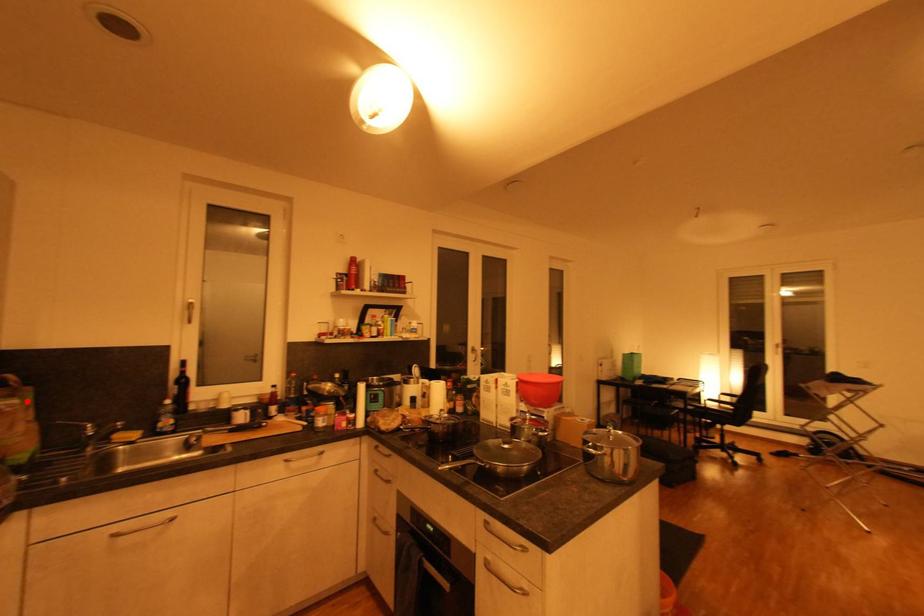
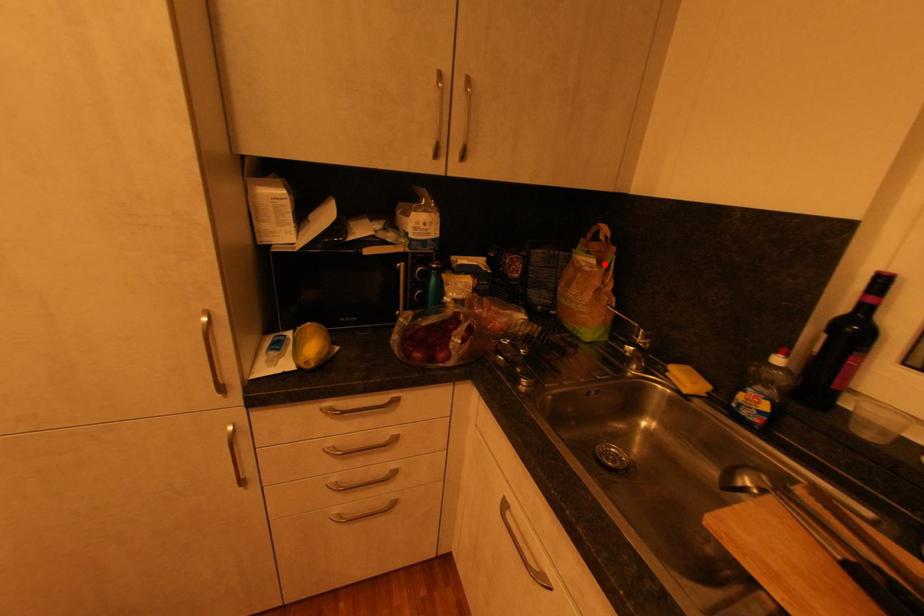
I am providing you with two images of the same scene from different viewpoints. A red point is marked on the first image and another point is marked on the second image. Does the point marked in image1 correspond to the same location as the one in image2?

Yes